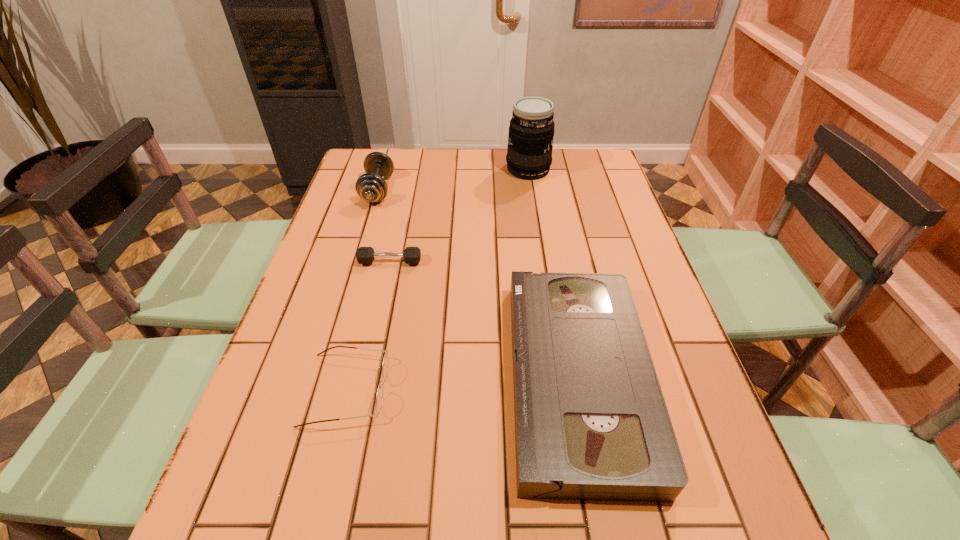
Where is `the tallest object`? the tallest object is located at coordinates (529, 154).

This screenshot has height=540, width=960. I want to click on the taller dumbbell, so click(x=371, y=187).

Where is `the farther dumbbell`? The height and width of the screenshot is (540, 960). the farther dumbbell is located at coordinates (371, 187).

At what (x,y) coordinates should I click in order to perform the action: click on videotape. Please return your answer as a coordinate pair (x, y). The width and height of the screenshot is (960, 540). Looking at the image, I should click on (591, 423).

At what (x,y) coordinates should I click in order to perform the action: click on spectacles. Please return your answer as a coordinate pair (x, y). This screenshot has height=540, width=960. Looking at the image, I should click on point(379,397).

Where is `the nearer dumbbell`? the nearer dumbbell is located at coordinates (365, 255).

You are a GUI agent. You are given a task and a screenshot of the screen. Output one action in this format:
    pyautogui.click(x=<x>, y=<y>)
    Task: Click on the shortest object
    This screenshot has width=960, height=540.
    Given the screenshot: What is the action you would take?
    pyautogui.click(x=365, y=255)

Identify the location of free space located on the left of the tallest object. (460, 170).

The height and width of the screenshot is (540, 960). Find the location of `free space located on the right of the taller dumbbell`. free space located on the right of the taller dumbbell is located at coordinates (426, 190).

At what (x,y) coordinates should I click in order to perform the action: click on vacant space situated on the left of the videotape. Please return your answer as a coordinate pair (x, y). The height and width of the screenshot is (540, 960). Looking at the image, I should click on (324, 377).